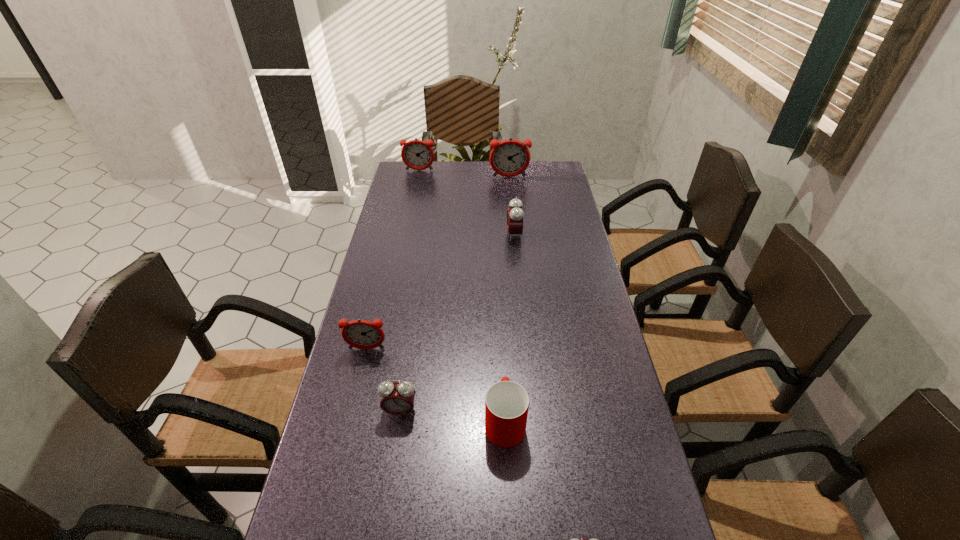
At what (x,y) coordinates should I click in order to perform the action: click on the third nearest alarm clock. Please return your answer as a coordinate pair (x, y). The image size is (960, 540). Looking at the image, I should click on (362, 334).

In order to click on vacant region located on the front-facing side of the tallest object in this screenshot , I will do `click(511, 193)`.

At what (x,y) coordinates should I click in order to perform the action: click on free point located 0.330m on the front-facing side of the farthest alarm clock. Please return your answer as a coordinate pair (x, y). The width and height of the screenshot is (960, 540). Looking at the image, I should click on 410,215.

Find the location of a particular element. vacant region located 0.320m on the clock face of the farthest pink alarm clock is located at coordinates (419, 235).

Identify the location of free location located 0.250m on the clock face of the farthest pink alarm clock. (438, 235).

I want to click on free space located on the clock face of the farthest pink alarm clock, so click(454, 235).

This screenshot has width=960, height=540. I want to click on vacant space located on the side of the red cup with the handle, so click(x=501, y=338).

Identify the location of free spot located 0.190m on the side of the red cup with the handle. The height and width of the screenshot is (540, 960). (501, 338).

The width and height of the screenshot is (960, 540). I want to click on free space located on the side of the red cup with the handle, so click(x=500, y=309).

Locate an element on the screen. vacant space located on the clock face of the second nearest pink alarm clock is located at coordinates (385, 512).